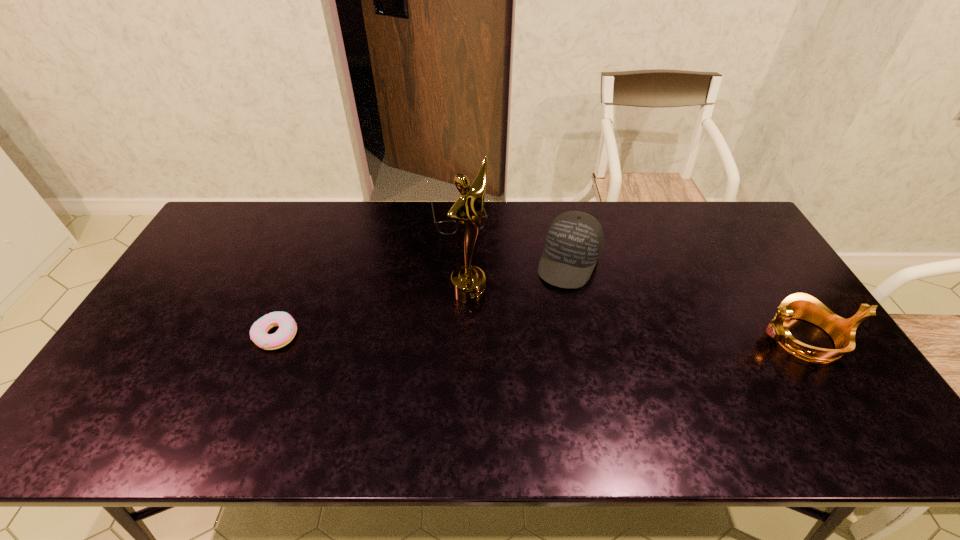
The height and width of the screenshot is (540, 960). Identify the location of empty space that is in between the second object from right to left and the award. (519, 276).

Where is `vacant point located between the spectacles and the second object from right to left`? This screenshot has height=540, width=960. vacant point located between the spectacles and the second object from right to left is located at coordinates (514, 240).

Find the location of a particular element. The image size is (960, 540). free space between the award and the shortest object is located at coordinates (372, 313).

Locate an element on the screen. free area in between the tallest object and the spectacles is located at coordinates (464, 255).

Where is `blank region between the tallest object and the tiara`? Image resolution: width=960 pixels, height=540 pixels. blank region between the tallest object and the tiara is located at coordinates (636, 315).

I want to click on empty location between the tallest object and the baseball cap, so click(x=519, y=276).

Locate an element on the screen. This screenshot has height=540, width=960. empty location between the spectacles and the leftmost object is located at coordinates [x=368, y=276].

I want to click on vacant space that's between the tallest object and the baseball cap, so click(519, 276).

This screenshot has height=540, width=960. Find the location of `object that can be found as the fourth closest to the tallest object`. object that can be found as the fourth closest to the tallest object is located at coordinates (799, 305).

You are a GUI agent. You are given a task and a screenshot of the screen. Output one action in this format:
    pyautogui.click(x=<x>, y=<y>)
    Task: Click on the fourth closest object to the fourth tallest object
    The width and height of the screenshot is (960, 540).
    Given the screenshot: What is the action you would take?
    pyautogui.click(x=799, y=305)